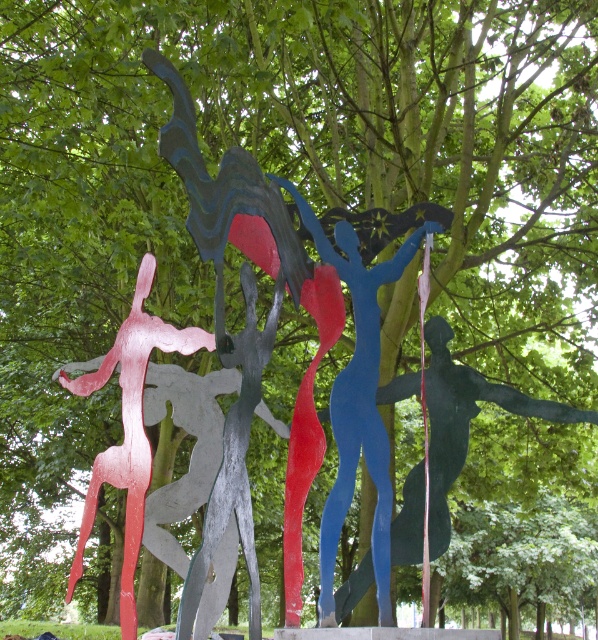
You are a photographer standing at a certain distance from the blue glossy figure at center. You want to capture a closeup shot of it. If your camera can focus on objects within 3 meters, will you need to move closer or farther away?

The blue glossy figure at center is 3.15 meters away from the camera. Since the camera can focus within 3 meters, you need to move closer to get a closeup shot.

You are standing in front of the sculpture and want to know which figure is positioned higher. Which one is higher between the metallic blue figure at center and the metallic pink figure at left?

The metallic blue figure at center is above the metallic pink figure at left, so the metallic blue figure at center is positioned higher.